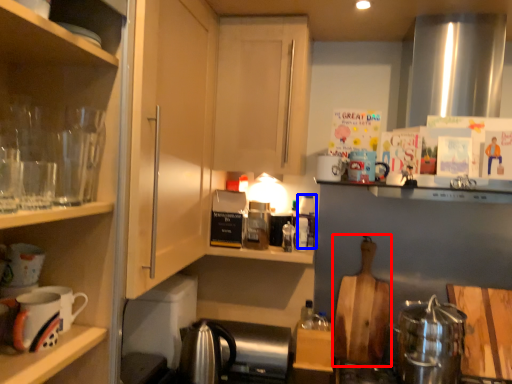
Question: Which object appears closest to the camera in this image, cutting board (highlighted by a red box) or bottle (highlighted by a blue box)?

Choices:
 (A) cutting board
 (B) bottle

Answer: (A)